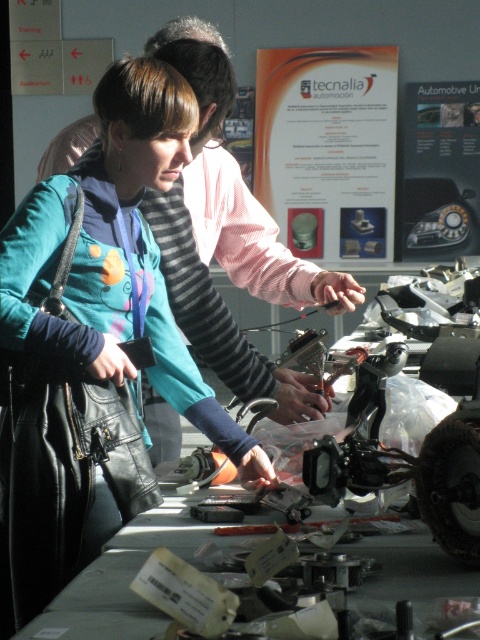
Question: Which object is closer to the camera taking this photo?

Choices:
 (A) teal fabric jacket at center
 (B) metallic gray tools at center

Answer: (B)

Question: Does teal fabric jacket at center have a smaller size compared to metallic gray tools at center?

Choices:
 (A) yes
 (B) no

Answer: (B)

Question: Does teal fabric jacket at center have a larger size compared to metallic gray tools at center?

Choices:
 (A) yes
 (B) no

Answer: (A)

Question: Is teal fabric jacket at center further to the viewer compared to metallic gray tools at center?

Choices:
 (A) no
 (B) yes

Answer: (B)

Question: Which of the following is the farthest from the observer?

Choices:
 (A) (48, 636)
 (B) (113, 285)

Answer: (B)